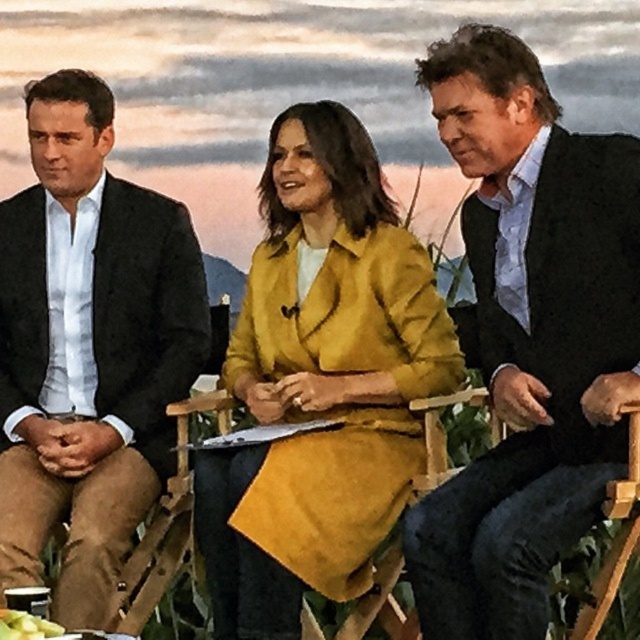
The height and width of the screenshot is (640, 640). What do you see at coordinates (529, 337) in the screenshot? I see `matte black suit at center` at bounding box center [529, 337].

The image size is (640, 640). I want to click on matte black suit at center, so click(529, 337).

This screenshot has height=640, width=640. In order to click on matte black suit at center in this screenshot , I will do `click(529, 337)`.

Which is in front, point (560, 429) or point (17, 372)?

Point (560, 429)

Is matte black suit at center closer to camera compared to matte black suit at left?

Yes.

At what (x,y) coordinates should I click in order to perform the action: click on matte black suit at center. Please return your answer as a coordinate pair (x, y). This screenshot has width=640, height=640. Looking at the image, I should click on (529, 337).

Does matte yellow coat at center appear under matte black suit at left?

Correct, matte yellow coat at center is located below matte black suit at left.

Locate an element on the screen. The image size is (640, 640). matte yellow coat at center is located at coordinates (321, 381).

This screenshot has width=640, height=640. I want to click on matte yellow coat at center, so click(x=321, y=381).